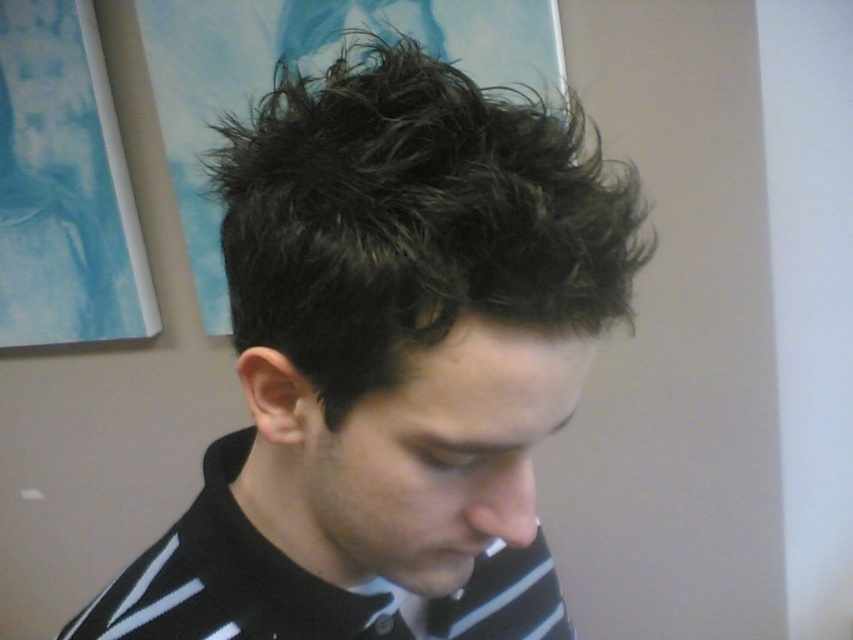
This screenshot has width=853, height=640. What do you see at coordinates (389, 362) in the screenshot?
I see `dark brown hair at center` at bounding box center [389, 362].

Consider the image. Is dark brown hair at center bigger than black striped shirt at center?

Yes.

The image size is (853, 640). What are the coordinates of `dark brown hair at center` in the screenshot? It's located at (389, 362).

Is point (229, 474) more distant than point (460, 547)?

Yes, point (229, 474) is farther from viewer.

Can you confirm if dark brown hair at center is smaller than matte black mouth at lower center?

No, dark brown hair at center is not smaller than matte black mouth at lower center.

This screenshot has height=640, width=853. Describe the element at coordinates (389, 362) in the screenshot. I see `dark brown hair at center` at that location.

Locate an element on the screen. Image resolution: width=853 pixels, height=640 pixels. dark brown hair at center is located at coordinates (389, 362).

Does black striped shirt at center have a greater height compared to matte black mouth at lower center?

Indeed, black striped shirt at center has a greater height compared to matte black mouth at lower center.

Is black striped shirt at center in front of matte black mouth at lower center?

No, black striped shirt at center is further to the viewer.

This screenshot has height=640, width=853. Describe the element at coordinates (228, 579) in the screenshot. I see `black striped shirt at center` at that location.

The width and height of the screenshot is (853, 640). In order to click on black striped shirt at center in this screenshot , I will do `click(228, 579)`.